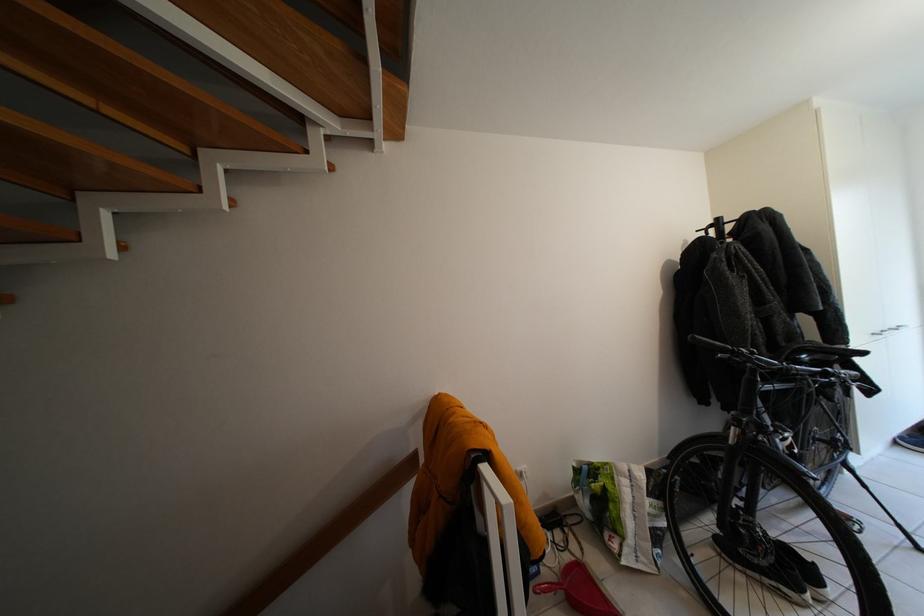
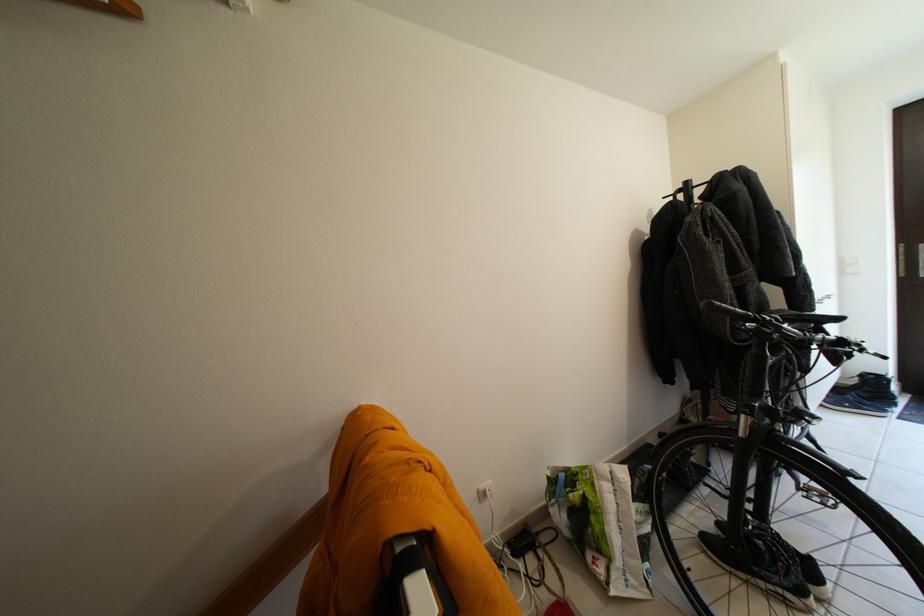
Question: How did the camera likely rotate?

Choices:
 (A) Left
 (B) Right
 (C) Up
 (D) Down

Answer: (B)